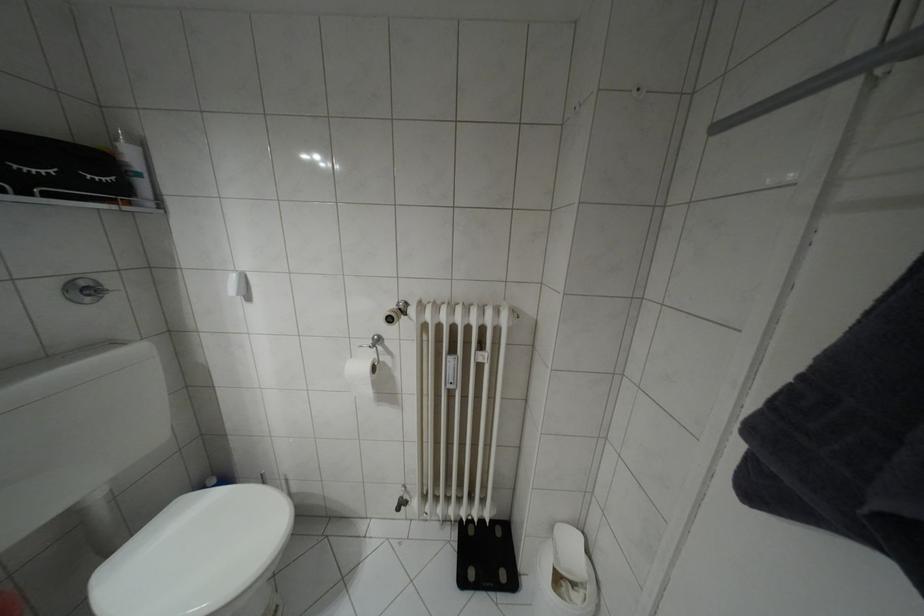
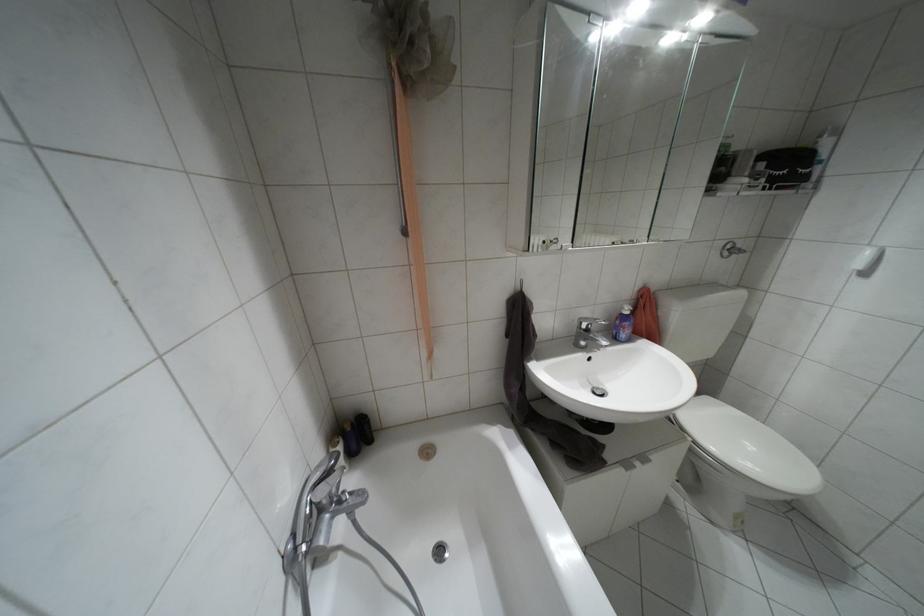
First-person continuous shooting, in which direction is the camera rotating?

The camera's rotation is toward left-down.